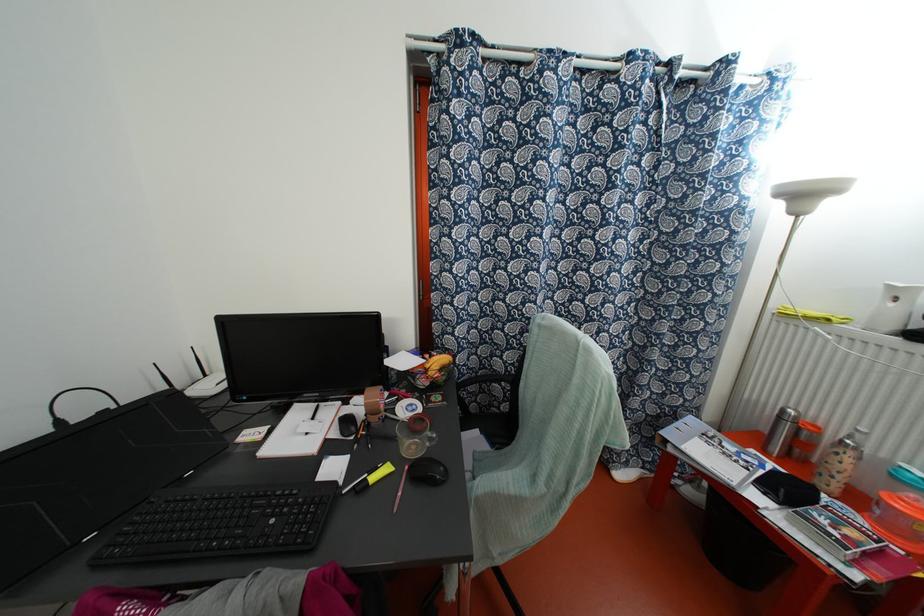
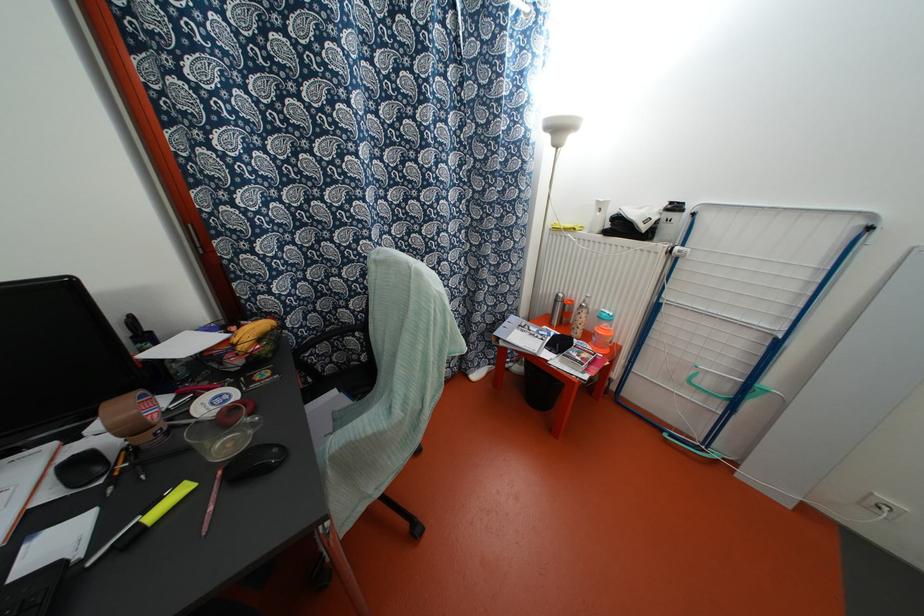
In the second image, find the point that corresponds to point 893,326 in the first image.

(599, 228)